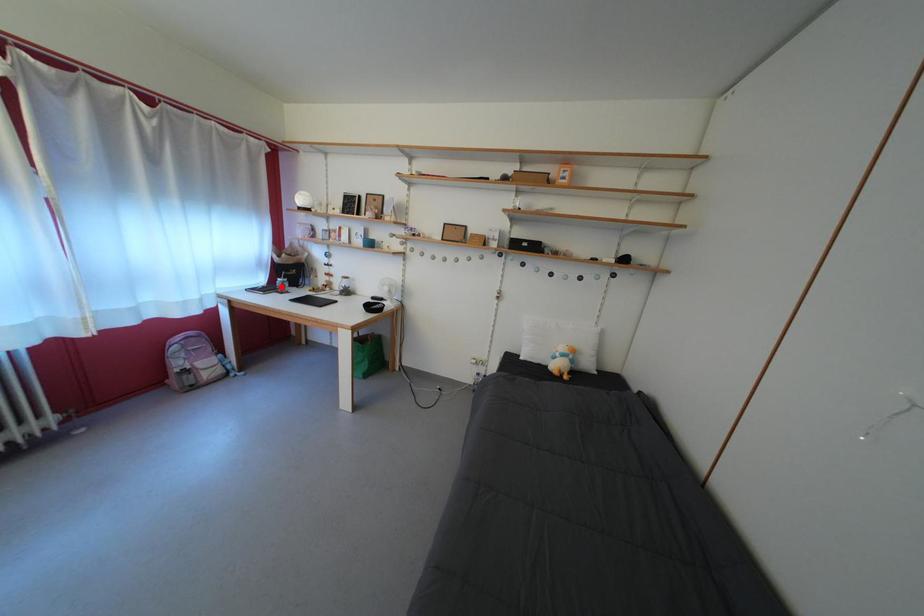
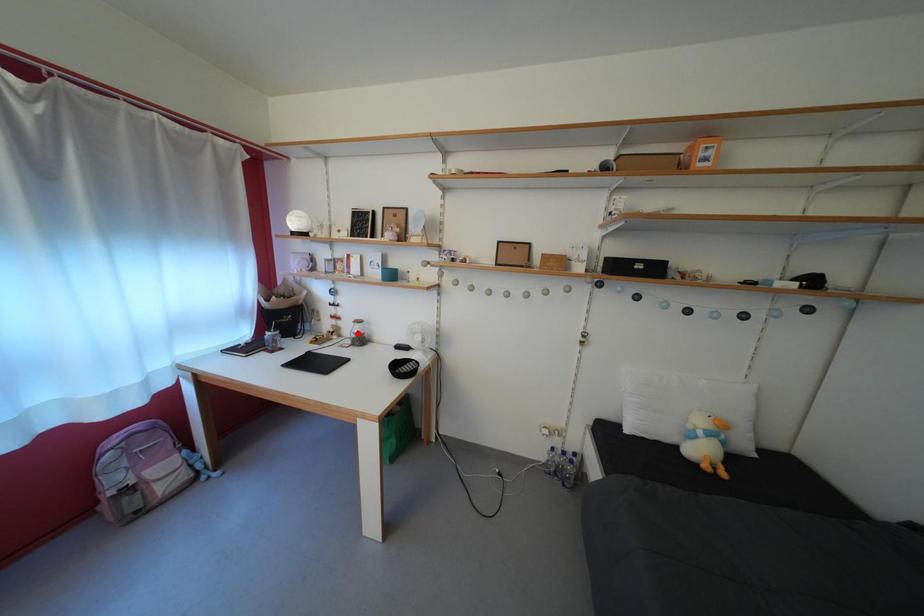
I am providing you with two images of the same scene from different viewpoints. A red point is marked on the first image and another point is marked on the second image. Are the points marked in image1 and image2 representing the same 3D position?

No